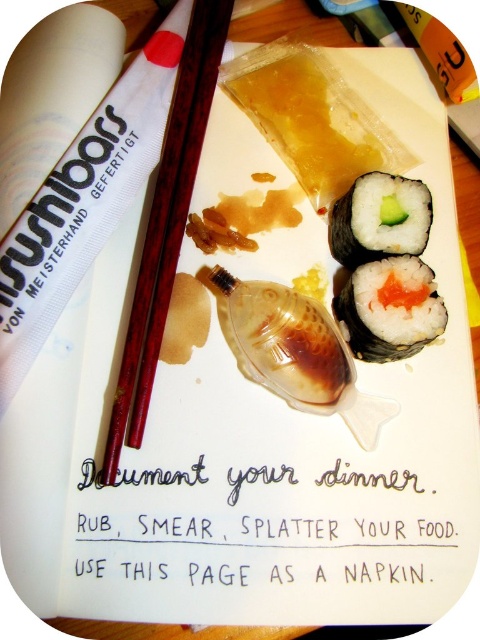
Can you confirm if white rice with salmon filling at center is shorter than white rice with seaweed at upper center?

No, white rice with salmon filling at center is not shorter than white rice with seaweed at upper center.

Who is positioned more to the right, white rice with salmon filling at center or white rice with seaweed at upper center?

From the viewer's perspective, white rice with salmon filling at center appears more on the right side.

Between point (406, 307) and point (352, 193), which one is positioned behind?

Point (352, 193)

Find the location of a particular element. The height and width of the screenshot is (640, 480). white rice with salmon filling at center is located at coordinates (389, 308).

Can you confirm if brown wood chopsticks at center is shorter than white rice with seaweed at upper center?

In fact, brown wood chopsticks at center may be taller than white rice with seaweed at upper center.

What do you see at coordinates (166, 225) in the screenshot?
I see `brown wood chopsticks at center` at bounding box center [166, 225].

This screenshot has height=640, width=480. In order to click on brown wood chopsticks at center in this screenshot , I will do point(166,225).

Based on the photo, does brown wood chopsticks at center have a smaller size compared to white rice with salmon filling at center?

No, brown wood chopsticks at center is not smaller than white rice with salmon filling at center.

Can you confirm if brown wood chopsticks at center is bigger than white rice with salmon filling at center?

Indeed, brown wood chopsticks at center has a larger size compared to white rice with salmon filling at center.

Identify the location of brown wood chopsticks at center. 166,225.

Locate an element on the screen. Image resolution: width=480 pixels, height=640 pixels. brown wood chopsticks at center is located at coordinates (166, 225).